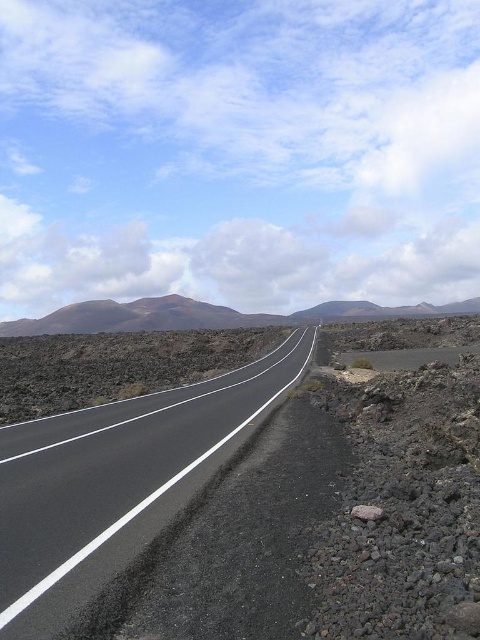
Is black asphalt highway at center to the right of brown volcanic rock at center from the viewer's perspective?

Incorrect, black asphalt highway at center is not on the right side of brown volcanic rock at center.

Does black asphalt highway at center have a larger size compared to brown volcanic rock at center?

Incorrect, black asphalt highway at center is not larger than brown volcanic rock at center.

Is point (34, 560) behind point (101, 314)?

No, (34, 560) is closer to viewer.

The image size is (480, 640). Identify the location of black asphalt highway at center. (117, 483).